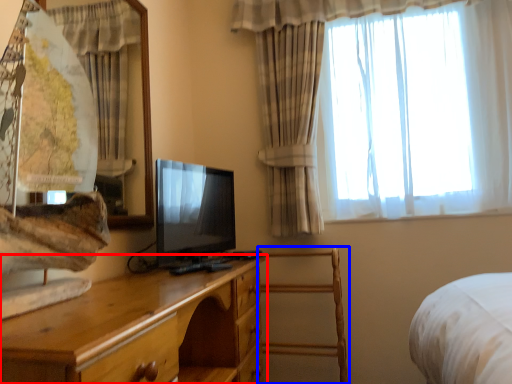
Question: Which of the following is the closest to the observer, chest of drawers (highlighted by a red box) or armchair (highlighted by a blue box)?

Choices:
 (A) chest of drawers
 (B) armchair

Answer: (A)